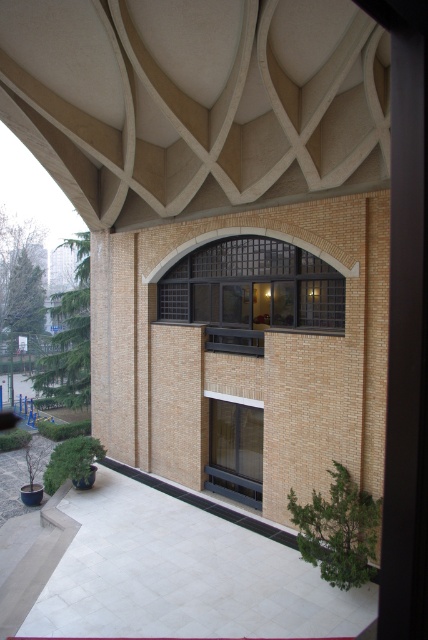
You are standing in front of the modern building and notice two windows at the center. The black metal window at center and the clear glass window at center. Which one is positioned higher?

The black metal window at center is above the clear glass window at center, so it is positioned higher.

From the picture: You are an architect designing a new building and want to place a decorative element exactly at the center of the black metal window at center. According to the image, what are the coordinates where you should place this element?

The coordinates for the center of the black metal window at center are at point (x=252, y=291).